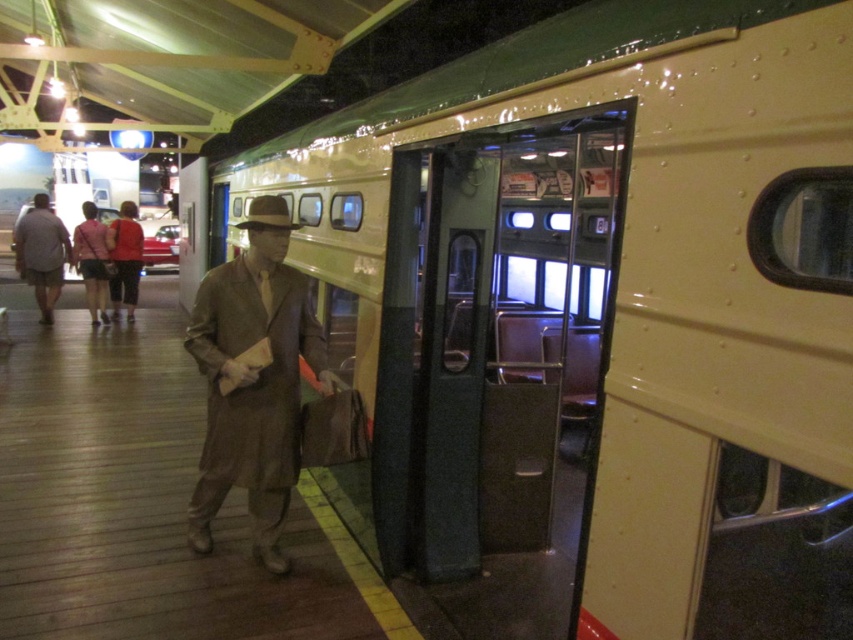
You are a tailor who needs to determine which garment requires more fabric to alter. Given the brown wool coat at center and the light beige fabric pants at left, which one would need more fabric due to its size?

The brown wool coat at center requires more fabric because it is larger in size than the light beige fabric pants at left.

You are a tailor assessing clothing items in a museum display. You notice the light beige fabric pants at left and the matte pink jacket at center. Which item has a greater height?

The light beige fabric pants at left is taller than matte pink jacket at center.

You are a visitor in the museum and want to take a photo of both the brown wool coat at center and the red fabric jacket at center. Can you fit both items in your camera frame if your camera has a maximum field of view of 6 meters?

The distance between the brown wool coat at center and the red fabric jacket at center is 7.38 meters, which exceeds the camera field of view of 6 meters. Therefore, you cannot fit both items in the frame at the same time.